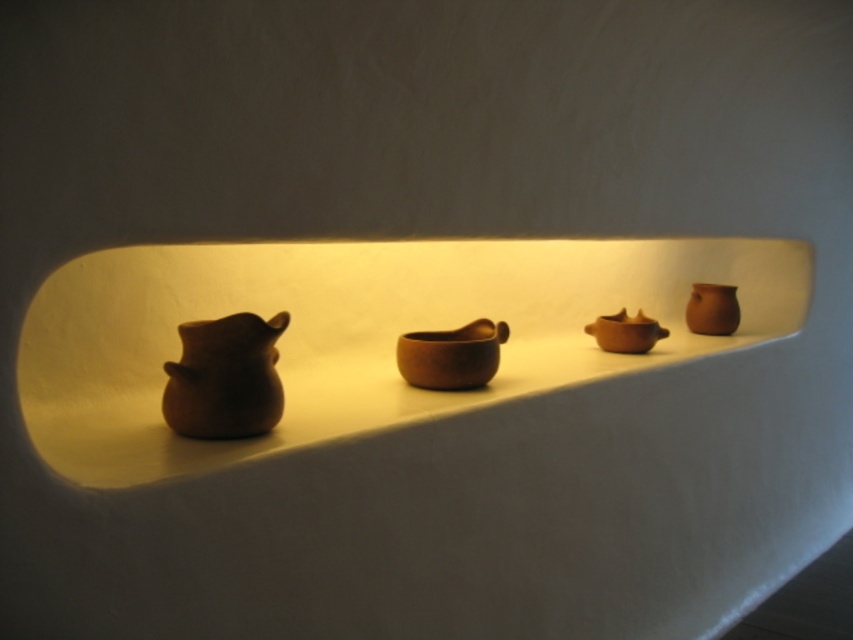
You are standing in front of a curved white shelf with four ceramic objects. You notice two points marked on the shelf at coordinates point (136,248) and point (637,333). Which of these points is closer to you?

Point (136,248) is closer to the viewer than point (637,333).

From the picture: You are an interior designer arranging items on a curved white shelf. You have a brown matte mortar at center and a matte brown bowl at center. Which object should you place first if you want to ensure there is enough space for both items?

The brown matte mortar at center is larger in size than the matte brown bowl at center, so you should place the brown matte mortar at center first to ensure there is enough space for both items.

You are an interior designer arranging items on a shelf. You have two objects to place on the shelf. The matte clay pots at center and the matte brown bowl at center. Given their sizes, which object should you place first to ensure stability?

The matte clay pots at center is larger in size than the matte brown bowl at center. Therefore, you should place the matte clay pots at center first to provide a stable base for the smaller matte brown bowl at center.